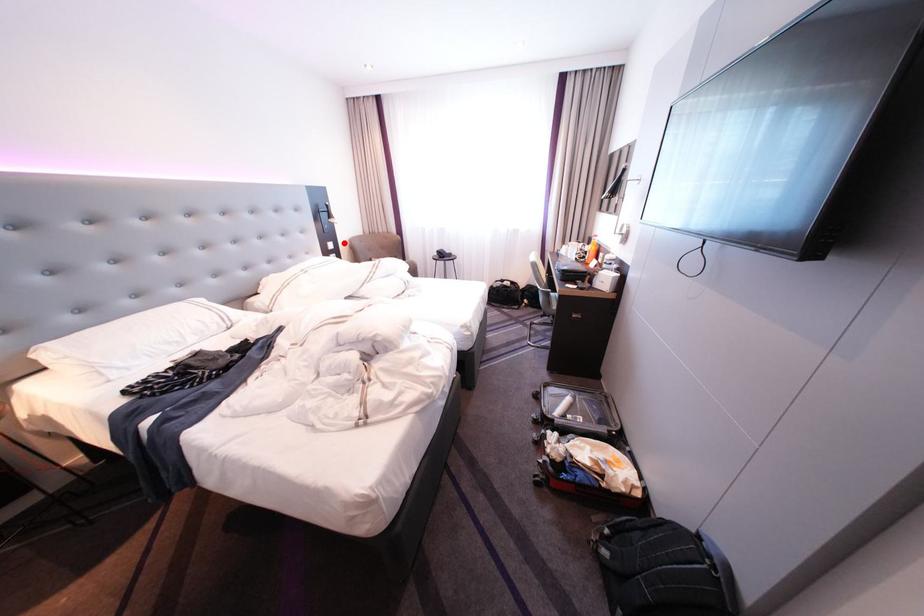
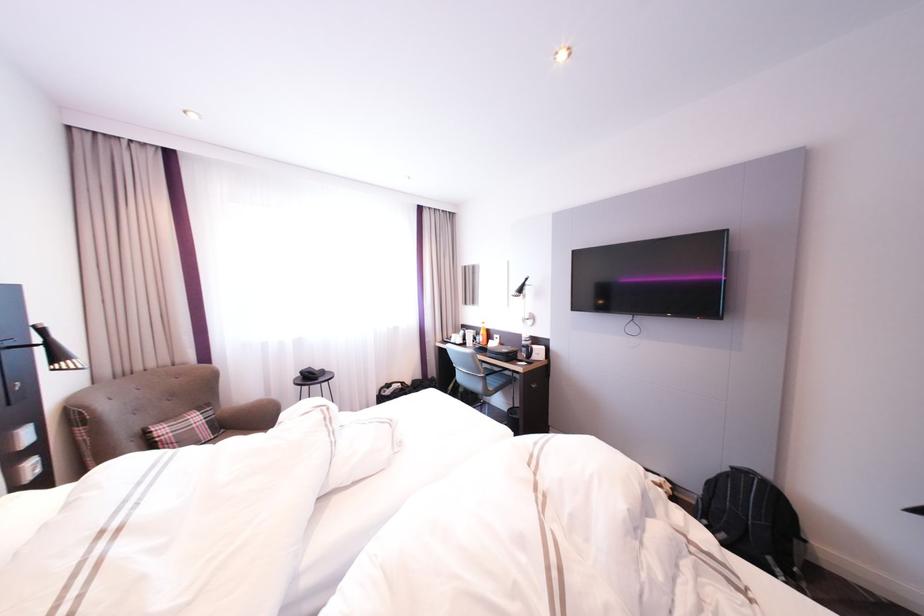
Where in the second image is the point corresponding to the highlighted location from the first image?

(43, 424)